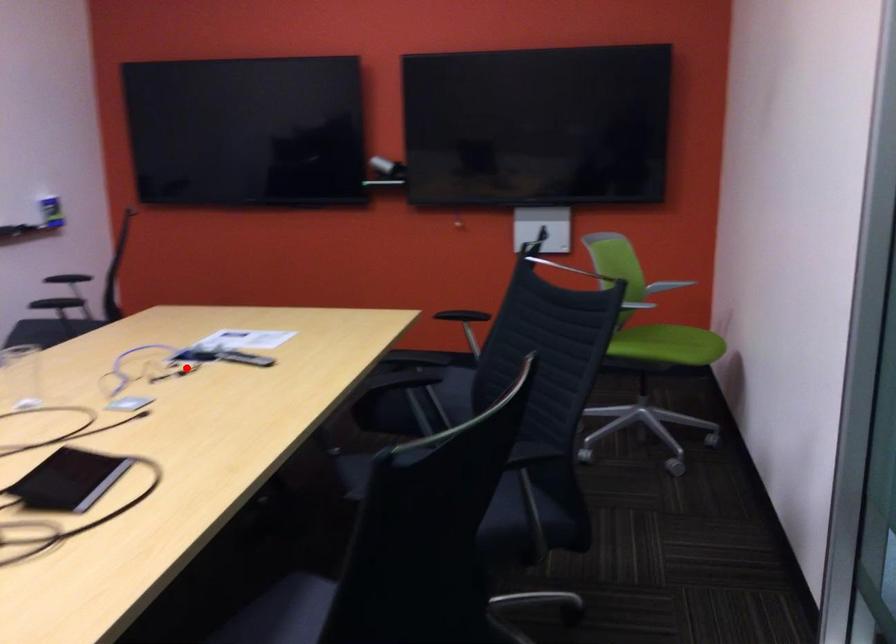
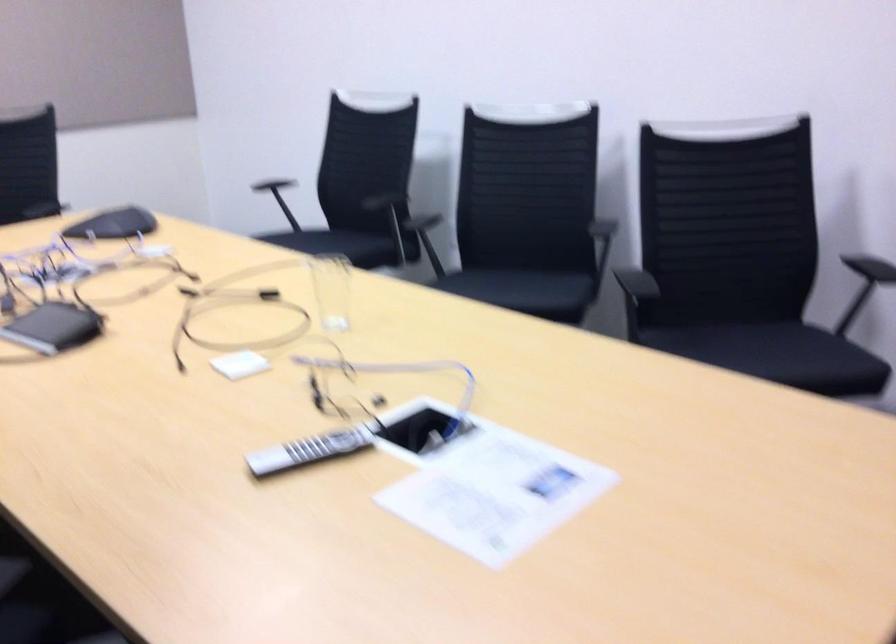
Find the pixel in the second image that matches the highlighted location in the first image.

(419, 430)